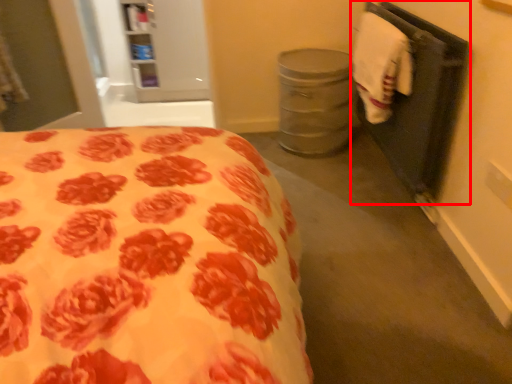
Question: Observing the image, what is the correct spatial positioning of closet (annotated by the red box) in reference to hand towel?

Choices:
 (A) left
 (B) right

Answer: (B)